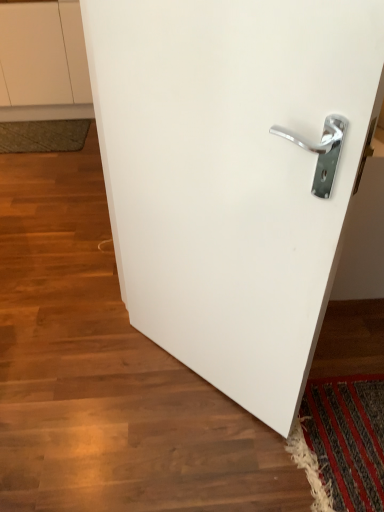
Locate an element on the screen. This screenshot has height=512, width=384. free point below white glossy door handle at center (from a real-world perspective) is located at coordinates (225, 475).